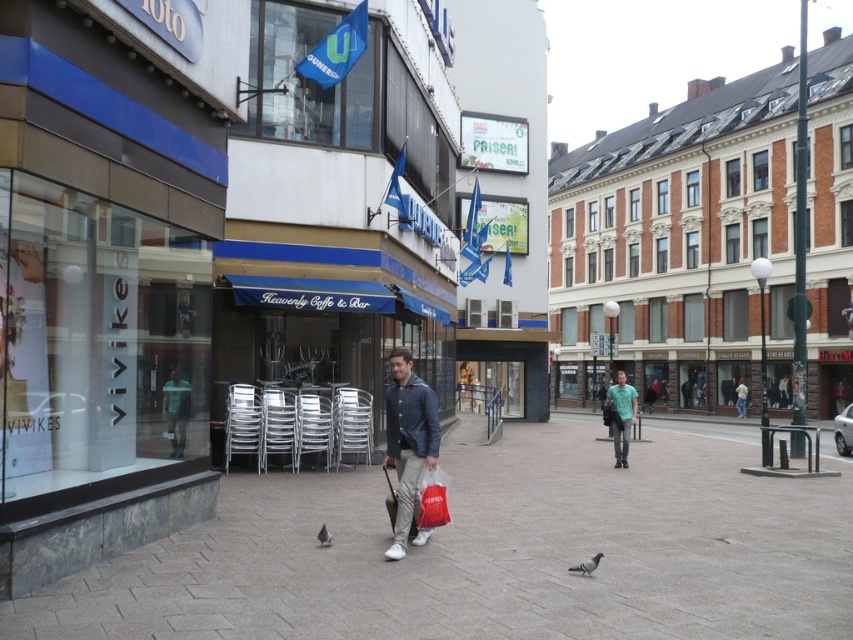
You are a tourist standing on the pedestrian street and want to take a photo of the brown brick building at center and the gray matte pigeon at center. Which object should you point your camera towards first if you want to capture both in one shot?

You should point your camera towards the gray matte pigeon at center first because the brown brick building at center is to the right of it, so by centering the pigeon, you can adjust the camera to include the building to its right in the frame.